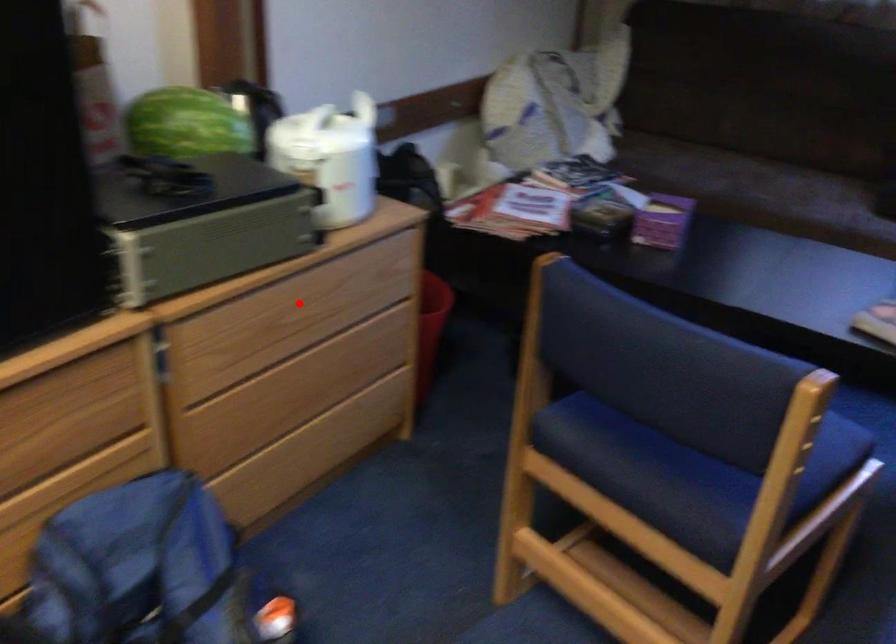
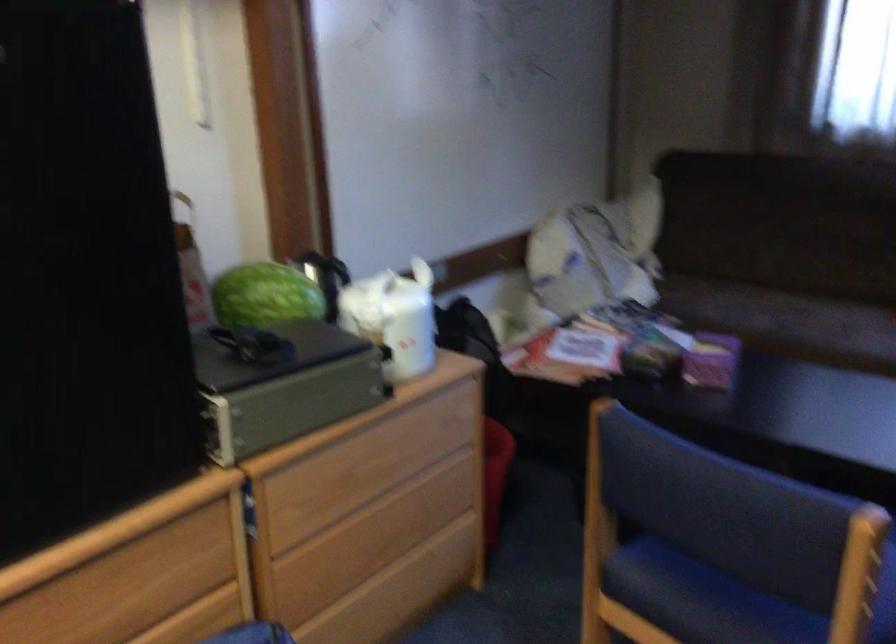
Locate, in the second image, the point that corresponds to the highlighted location in the first image.

(373, 457)